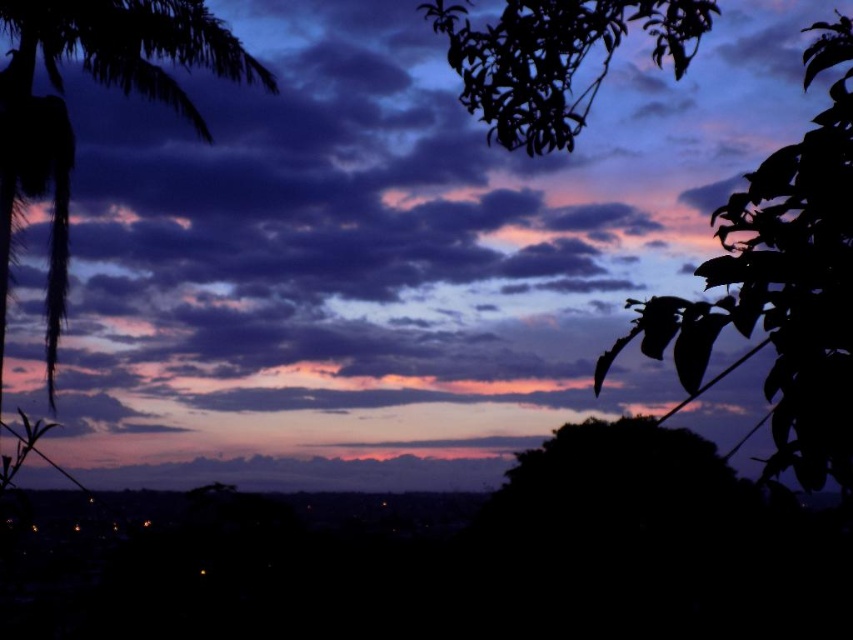
Is silky black palm tree at left bigger than green leafy branch at upper right?

Yes.

Which is behind, point (51, 337) or point (683, 58)?

The point (51, 337) is more distant.

Which is behind, point (3, 317) or point (550, 1)?

The point (3, 317) is more distant.

This screenshot has height=640, width=853. I want to click on silky black palm tree at left, so click(x=100, y=83).

Is silky dark leaves at upper right shorter than green leafy branch at upper right?

No.

This screenshot has height=640, width=853. What do you see at coordinates (779, 298) in the screenshot? I see `silky dark leaves at upper right` at bounding box center [779, 298].

Does point (805, 161) come in front of point (688, 40)?

Yes, point (805, 161) is in front of point (688, 40).

I want to click on silky dark leaves at upper right, so click(x=779, y=298).

Is silky dark leaves at upper right below silky black palm tree at left?

Correct, silky dark leaves at upper right is located below silky black palm tree at left.

Is silky dark leaves at upper right closer to camera compared to silky black palm tree at left?

Yes, silky dark leaves at upper right is closer to the viewer.

What do you see at coordinates (779, 298) in the screenshot? The image size is (853, 640). I see `silky dark leaves at upper right` at bounding box center [779, 298].

The width and height of the screenshot is (853, 640). What are the coordinates of `silky dark leaves at upper right` in the screenshot? It's located at (779, 298).